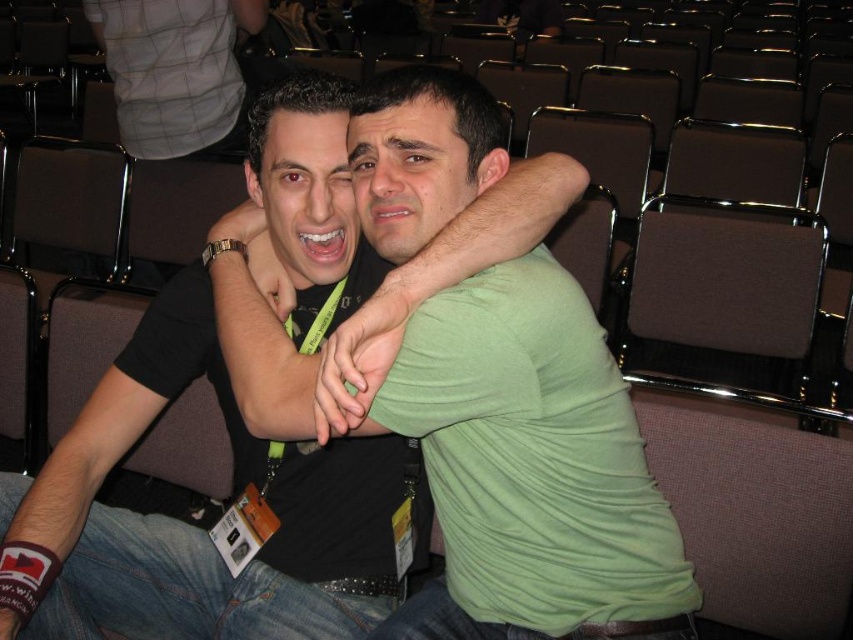
Question: Considering the relative positions of green matte shirt at center and green matte arm at center in the image provided, where is green matte shirt at center located with respect to green matte arm at center?

Choices:
 (A) left
 (B) right

Answer: (A)

Question: Which point appears farthest from the camera in this image?

Choices:
 (A) (180, 337)
 (B) (383, 339)

Answer: (A)

Question: Does maroon fabric wristband at lower left have a smaller size compared to green matte arm at center?

Choices:
 (A) no
 (B) yes

Answer: (A)

Question: Is green matte shirt at center closer to the viewer compared to green matte arm at center?

Choices:
 (A) yes
 (B) no

Answer: (B)

Question: Which point is farther from the camera taking this photo?

Choices:
 (A) (416, 540)
 (B) (7, 529)
 (C) (337, 420)

Answer: (A)

Question: Which object is positioned farthest from the green matte arm at center?

Choices:
 (A) green matte shirt at center
 (B) maroon fabric wristband at lower left

Answer: (B)